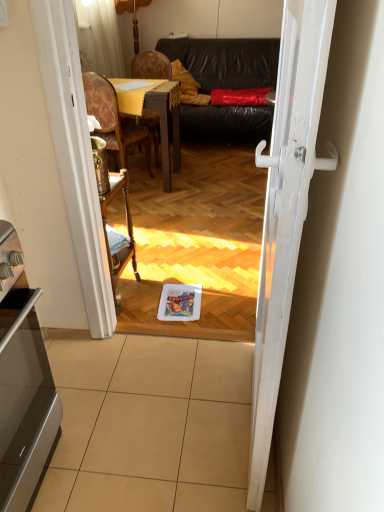
This screenshot has height=512, width=384. What are the coordinates of `free space above beige tile at lower center (from a real-world perspective)` in the screenshot? It's located at (146, 410).